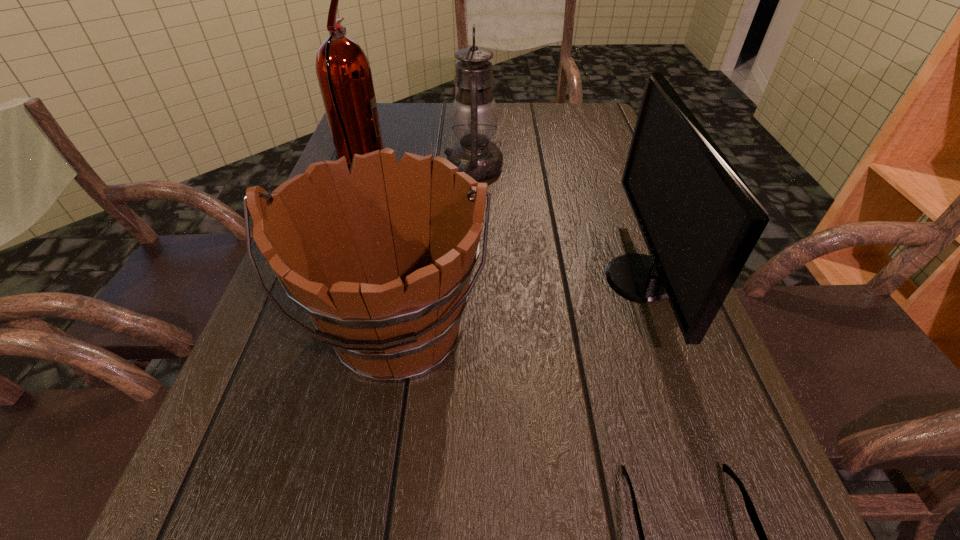
Find the location of a particular element. This screenshot has height=540, width=960. fire extinguisher that is at the left edge is located at coordinates (343, 71).

Where is `wine bucket located at the left edge`? The height and width of the screenshot is (540, 960). wine bucket located at the left edge is located at coordinates (380, 257).

The height and width of the screenshot is (540, 960). What are the coordinates of `object located at the right edge` in the screenshot? It's located at (700, 221).

In the image, there is a desktop. Identify the location of free space at the far edge. Image resolution: width=960 pixels, height=540 pixels. (420, 117).

This screenshot has height=540, width=960. Find the location of `vacant space at the left edge of the desktop`. vacant space at the left edge of the desktop is located at coordinates (290, 407).

In the image, there is a desktop. At what (x,y) coordinates should I click in order to perform the action: click on free region at the right edge. Please return your answer as a coordinate pair (x, y). The image size is (960, 540). Looking at the image, I should click on (613, 219).

The image size is (960, 540). Identify the location of object that is the fourth closest to the wine bucket. (474, 116).

Select which object appears as the closest to the wine bucket. Please provide its 2D coordinates. Your answer should be formatted as a tuple, i.e. [(x, y)], where the tuple contains the x and y coordinates of a point satisfying the conditions above.

[(750, 508)]